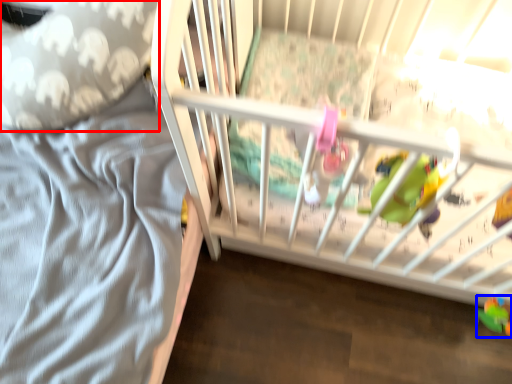
Question: Which object is closer to the camera taking this photo, throw pillow (highlighted by a red box) or toy (highlighted by a blue box)?

Choices:
 (A) throw pillow
 (B) toy

Answer: (A)